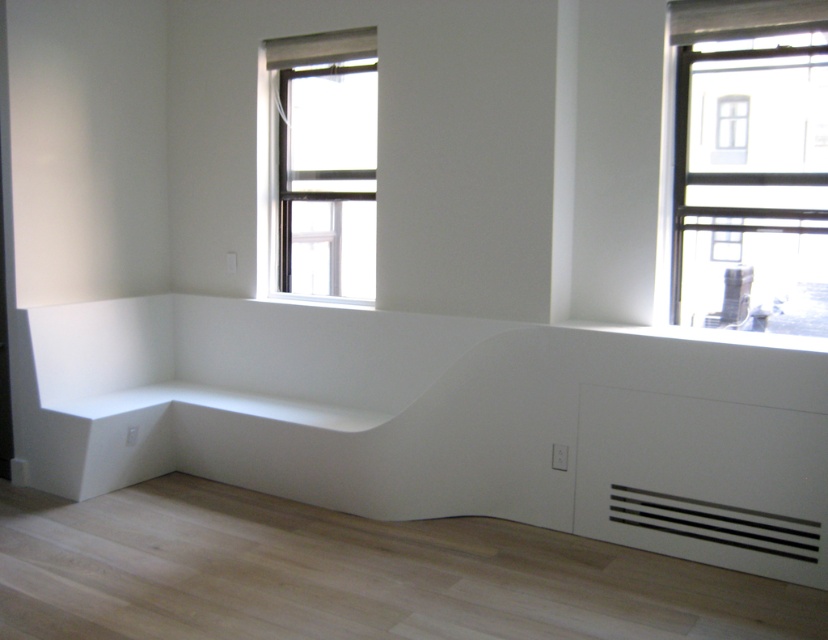
Measure the distance from white smooth bench at lower left to clear glass window at upper center.

36.88 inches

Where is `white smooth bench at lower left`? The image size is (828, 640). white smooth bench at lower left is located at coordinates 437,420.

Find the location of a particular element. The height and width of the screenshot is (640, 828). white smooth bench at lower left is located at coordinates (437, 420).

Is white smooth bench at lower left thinner than transparent glass chair at upper right?

No, white smooth bench at lower left is not thinner than transparent glass chair at upper right.

Describe the element at coordinates (437, 420) in the screenshot. I see `white smooth bench at lower left` at that location.

Which is behind, point (575, 486) or point (677, 16)?

The point (575, 486) is more distant.

Locate an element on the screen. white smooth bench at lower left is located at coordinates pyautogui.click(x=437, y=420).

Which is above, transparent glass chair at upper right or clear glass window at upper center?

clear glass window at upper center

Locate an element on the screen. This screenshot has width=828, height=640. transparent glass chair at upper right is located at coordinates (749, 164).